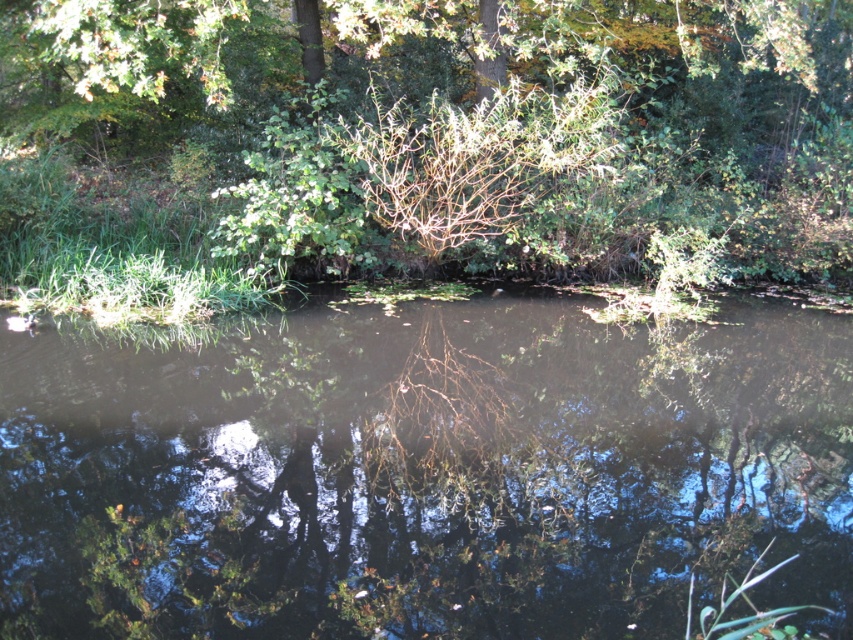
Question: In this image, where is transparent water at center located relative to green leafy bush at upper center?

Choices:
 (A) below
 (B) above

Answer: (A)

Question: Does transparent water at center appear on the left side of green leafy bush at upper center?

Choices:
 (A) no
 (B) yes

Answer: (A)

Question: Among these objects, which one is farthest from the camera?

Choices:
 (A) green leafy bush at upper center
 (B) transparent water at center

Answer: (A)

Question: Which point is farther to the camera?

Choices:
 (A) green leafy bush at upper center
 (B) transparent water at center

Answer: (A)

Question: Is the position of transparent water at center more distant than that of green leafy bush at upper center?

Choices:
 (A) no
 (B) yes

Answer: (A)

Question: Which point is closer to the camera?

Choices:
 (A) transparent water at center
 (B) green leafy bush at upper center

Answer: (A)